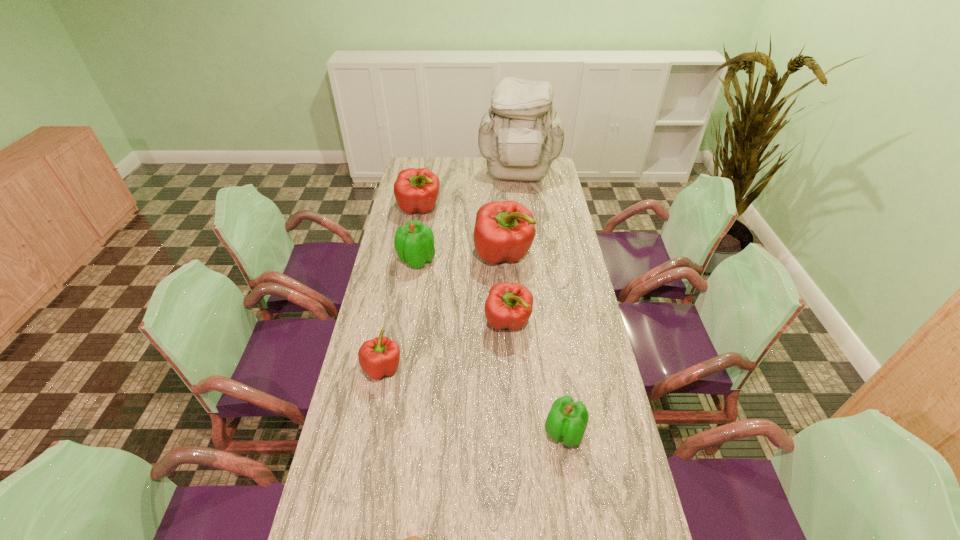
Locate an element on the screen. The image size is (960, 540). the nearer green bell pepper is located at coordinates (567, 420).

Identify the location of the nearest bell pepper. The height and width of the screenshot is (540, 960). (567, 420).

This screenshot has height=540, width=960. I want to click on the third nearest object, so click(x=380, y=356).

The image size is (960, 540). Identify the location of the smallest pink bell pepper. (380, 356).

I want to click on free region located 0.350m on the front-facing side of the backpack, so click(525, 237).

Where is `blank space located on the right of the tallest bell pepper`? The height and width of the screenshot is (540, 960). blank space located on the right of the tallest bell pepper is located at coordinates (566, 255).

The height and width of the screenshot is (540, 960). Identify the location of vacant space positioned on the front of the second farthest object. (406, 285).

Locate an element on the screen. vacant space located on the front of the left green bell pepper is located at coordinates tap(403, 346).

The image size is (960, 540). Find the location of `vacant space situated 0.120m on the left of the fourth nearest object`. vacant space situated 0.120m on the left of the fourth nearest object is located at coordinates (450, 323).

At what (x,y) coordinates should I click in order to perform the action: click on vacant area located on the back of the right green bell pepper. Please return your answer as a coordinate pair (x, y). The image size is (960, 540). Looking at the image, I should click on (554, 360).